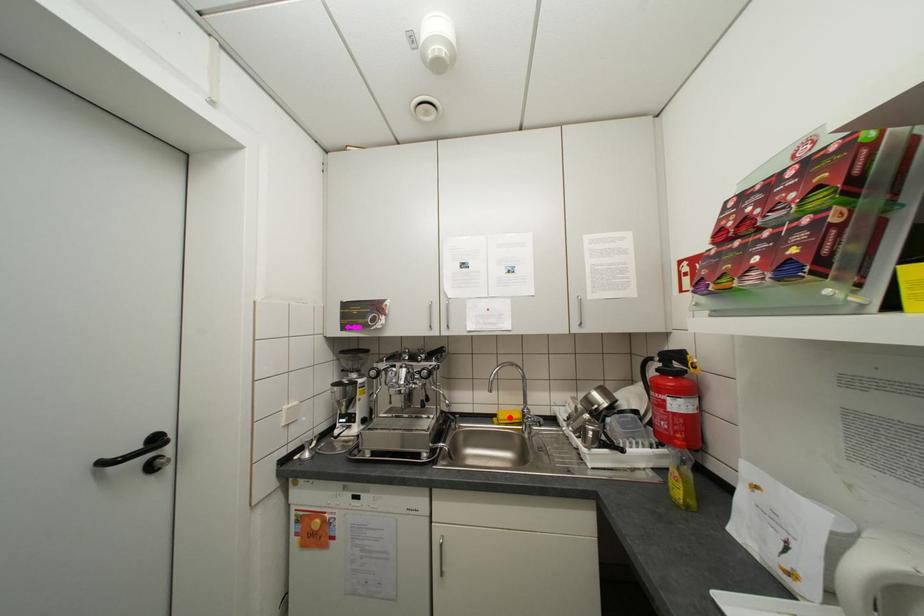
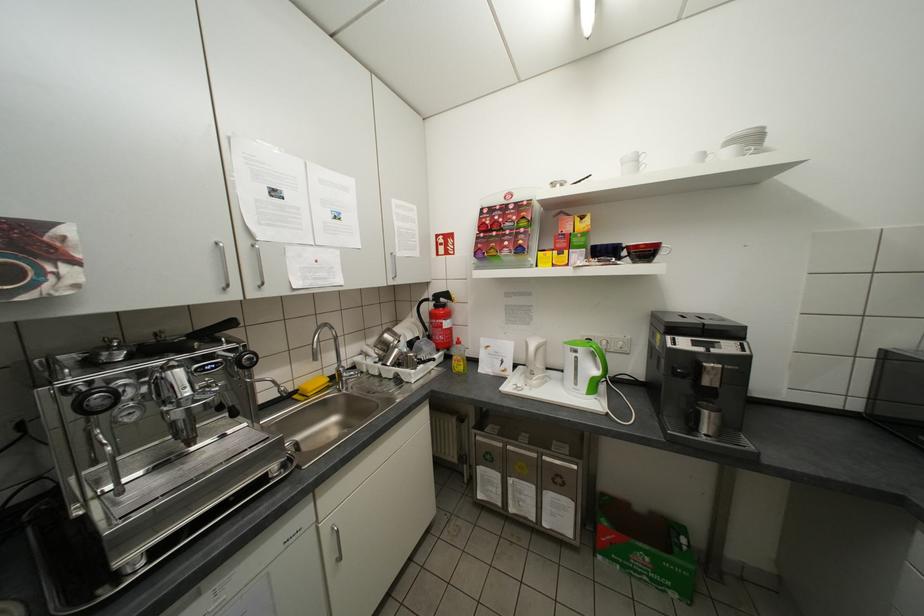
Where in the second image is the point corresponding to the highlighted location from the first image?

(319, 389)